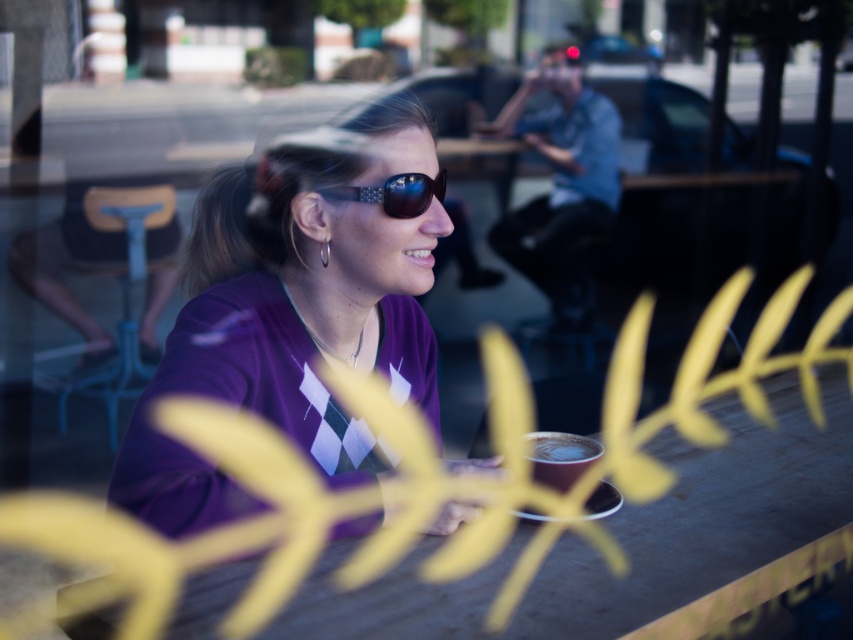
Question: Can you confirm if purple matte sweater at center is wider than shiny black sunglasses at center?

Choices:
 (A) yes
 (B) no

Answer: (A)

Question: Does smooth wooden table at center lie behind cappuccino foam at center?

Choices:
 (A) no
 (B) yes

Answer: (A)

Question: Can you confirm if smooth wooden table at center is thinner than matte black coffee cup at center?

Choices:
 (A) no
 (B) yes

Answer: (A)

Question: Which of the following is the closest to the observer?

Choices:
 (A) (560, 472)
 (B) (788, 580)

Answer: (B)

Question: Estimate the real-world distances between objects in this image. Which object is farther from the purple matte sweater at center?

Choices:
 (A) shiny black sunglasses at center
 (B) matte black coffee cup at center
 (C) smooth wooden table at center

Answer: (B)

Question: Which point is farther to the camera?

Choices:
 (A) (579, 452)
 (B) (392, 205)
 (C) (647, 442)

Answer: (C)